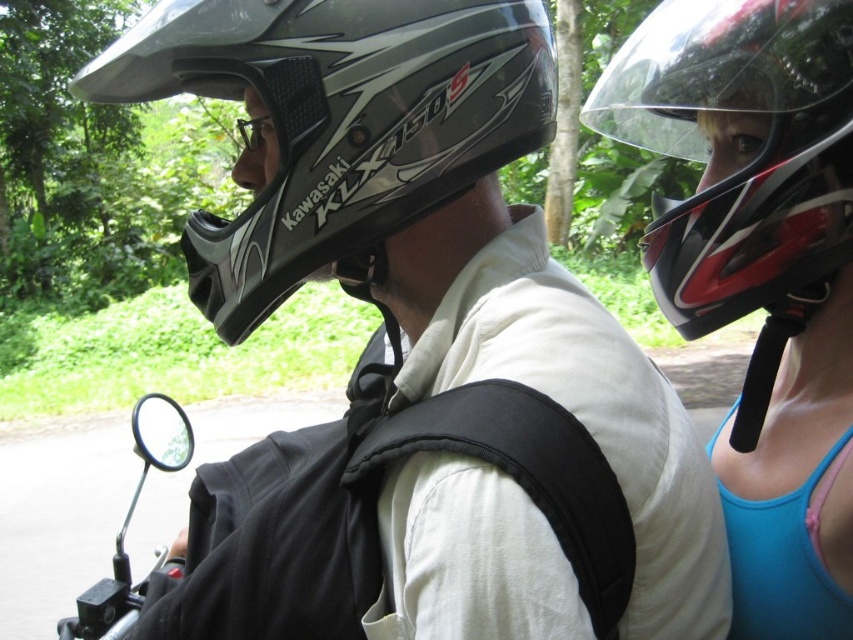
Question: Can you confirm if shiny black helmet at upper right is bigger than clear plastic goggles at center?

Choices:
 (A) no
 (B) yes

Answer: (A)

Question: Which of these objects is positioned farthest from the shiny metallic helmet at center?

Choices:
 (A) clear plastic goggles at center
 (B) black fabric strap at center
 (C) shiny black helmet at upper right
 (D) black rubber side mirror at lower left

Answer: (A)

Question: Observing the image, what is the correct spatial positioning of shiny black helmet at upper right in reference to black fabric strap at center?

Choices:
 (A) above
 (B) below

Answer: (A)

Question: Which object is positioned farthest from the black fabric strap at center?

Choices:
 (A) clear plastic goggles at center
 (B) black rubber side mirror at lower left

Answer: (B)

Question: Which is nearer to the clear plastic goggles at center?

Choices:
 (A) black fabric strap at center
 (B) shiny black helmet at upper right
 (C) black rubber side mirror at lower left

Answer: (A)

Question: Can you confirm if black rubber side mirror at lower left is positioned to the left of clear plastic goggles at center?

Choices:
 (A) no
 (B) yes

Answer: (A)